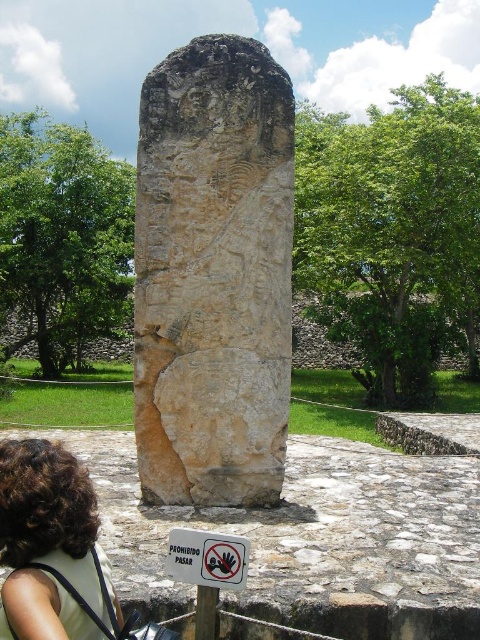
You are an archaeologist examining the ancient stone monument. You notice two points marked on the monument. The first point is at coordinates point [54,509] and the second is at point [201,532]. Which of these points is nearer to you as you stand in front of the monument?

Point [54,509] is closer to the viewer than point [201,532].

You are an archaeologist examining the ancient stone monument. You notice two features on the monument surface. The first is the brown curly hair at lower left, and the second is the brown stone pillar at center. Which of these features is taller?

The brown curly hair at lower left is taller than the brown stone pillar at center.